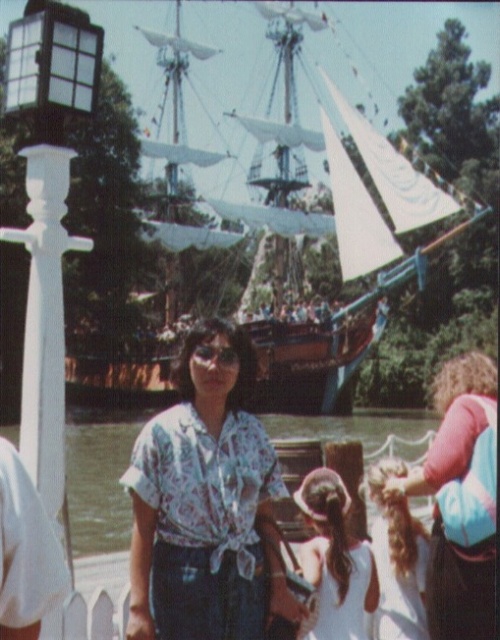
Question: Which point appears farthest from the camera in this image?

Choices:
 (A) (381, 468)
 (B) (451, 589)
 (C) (88, 502)
 (D) (242, 596)

Answer: (C)

Question: Is floral shirt at center to the left of curly hair at center from the viewer's perspective?

Choices:
 (A) no
 (B) yes

Answer: (B)

Question: Which point is farther from the camera taking this photo?

Choices:
 (A) [x=112, y=516]
 (B) [x=453, y=448]
 (C) [x=416, y=589]
 (D) [x=220, y=266]

Answer: (D)

Question: Which object is positioned farthest from the blonde hair at lower right?

Choices:
 (A) clear water at lower center
 (B) white fabric dress at center
 (C) curly hair at center

Answer: (A)

Question: Is floral shirt at center further to camera compared to clear water at lower center?

Choices:
 (A) yes
 (B) no

Answer: (B)

Question: Is floral shirt at center to the right of blonde hair at lower right from the viewer's perspective?

Choices:
 (A) yes
 (B) no

Answer: (B)